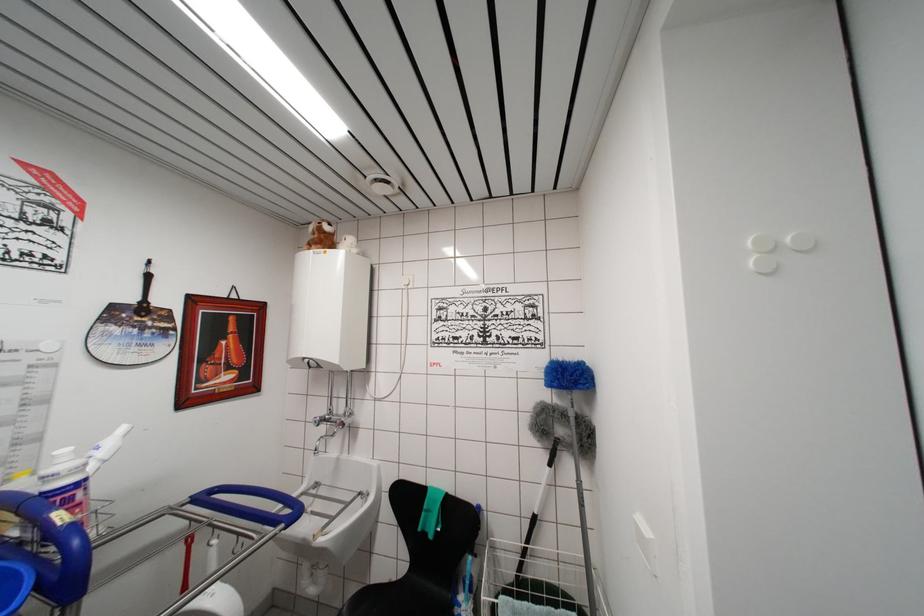
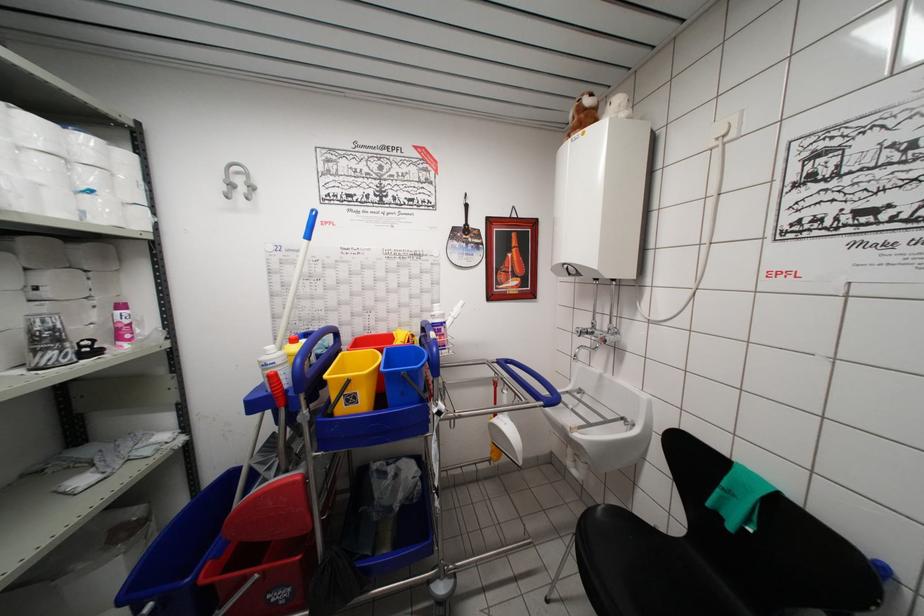
Question: The first image is from the beginning of the video and the second image is from the end. How did the camera likely rotate when shooting the video?

Choices:
 (A) Left
 (B) Right
 (C) Up
 (D) Down

Answer: (A)